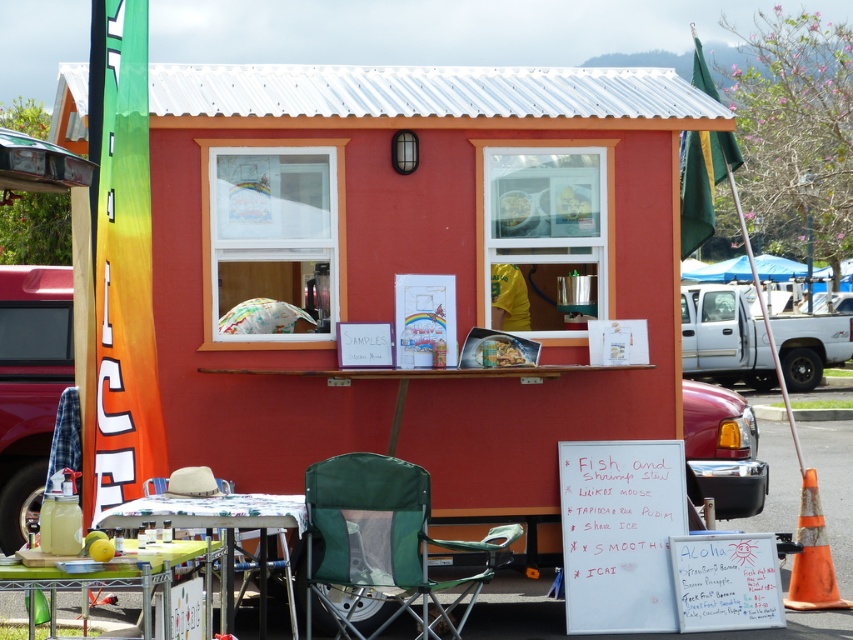
You are a customer at the food stall and want to sit down to eat your meal. You have a large plate of food that requires a flat surface. Can you place your plate on the green fabric folding chair at lower center or the green plastic table at lower left without it falling off?

The green plastic table at lower left has a flat surface, so you can safely place your plate there. The green fabric folding chair at lower center does not have a flat surface suitable for placing a plate.